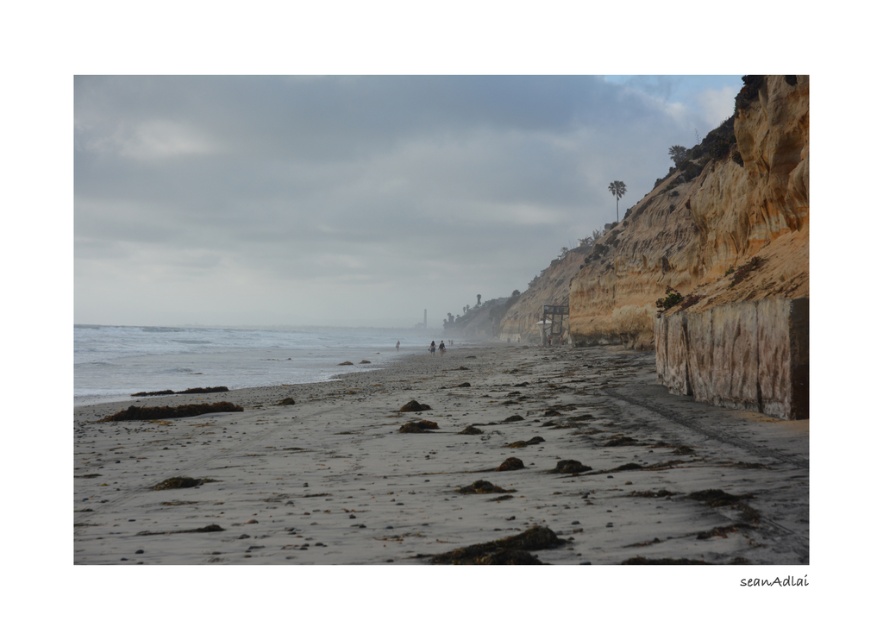
Question: Does brown rocky cliff at right have a lesser width compared to blurred human figure at center?

Choices:
 (A) no
 (B) yes

Answer: (A)

Question: Can you confirm if gray sandy beach at lower center is smaller than brown rocky cliff at right?

Choices:
 (A) yes
 (B) no

Answer: (A)

Question: Where is brown rocky cliff at right located in relation to blurred human figure at center in the image?

Choices:
 (A) above
 (B) below

Answer: (A)

Question: Which is farther from the blurred human figure at center?

Choices:
 (A) brown rocky cliff at right
 (B) gray sandy beach at lower center

Answer: (B)

Question: Which object is farther from the camera taking this photo?

Choices:
 (A) blurred human figure at center
 (B) gray sandy beach at lower center
 (C) brown rocky cliff at right

Answer: (A)

Question: Which of the following is the farthest from the observer?

Choices:
 (A) gray sandy beach at lower center
 (B) brown rocky cliff at right
 (C) blurred human figure at center

Answer: (C)